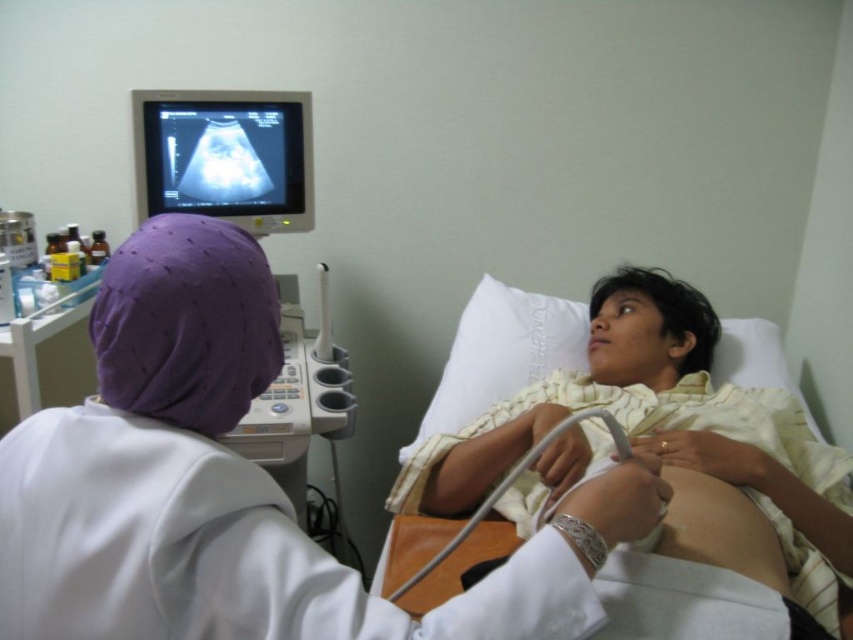
The width and height of the screenshot is (853, 640). What do you see at coordinates (225, 156) in the screenshot?
I see `matte black monitor at upper left` at bounding box center [225, 156].

Who is higher up, matte black monitor at upper left or gray rubber ultrasound probe at lower center?

matte black monitor at upper left is above.

The image size is (853, 640). What do you see at coordinates (225, 156) in the screenshot?
I see `matte black monitor at upper left` at bounding box center [225, 156].

Locate an element on the screen. The image size is (853, 640). matte black monitor at upper left is located at coordinates (225, 156).

Who is taller, white matte lab coat at center or white fabric hospital bed at center?

With more height is white fabric hospital bed at center.

Is point (154, 497) closer to viewer compared to point (827, 604)?

Yes, point (154, 497) is closer to viewer.

Is point (614, 512) more distant than point (474, 464)?

No, (614, 512) is closer to viewer.

This screenshot has height=640, width=853. I want to click on white matte lab coat at center, so click(231, 484).

Is point (648, 397) positioned in front of point (519, 460)?

No, it is behind (519, 460).

How much distance is there between white fabric hospital bed at center and gray rubber ultrasound probe at lower center?

white fabric hospital bed at center is 7.81 inches from gray rubber ultrasound probe at lower center.

Locate an element on the screen. Image resolution: width=853 pixels, height=640 pixels. white fabric hospital bed at center is located at coordinates (665, 433).